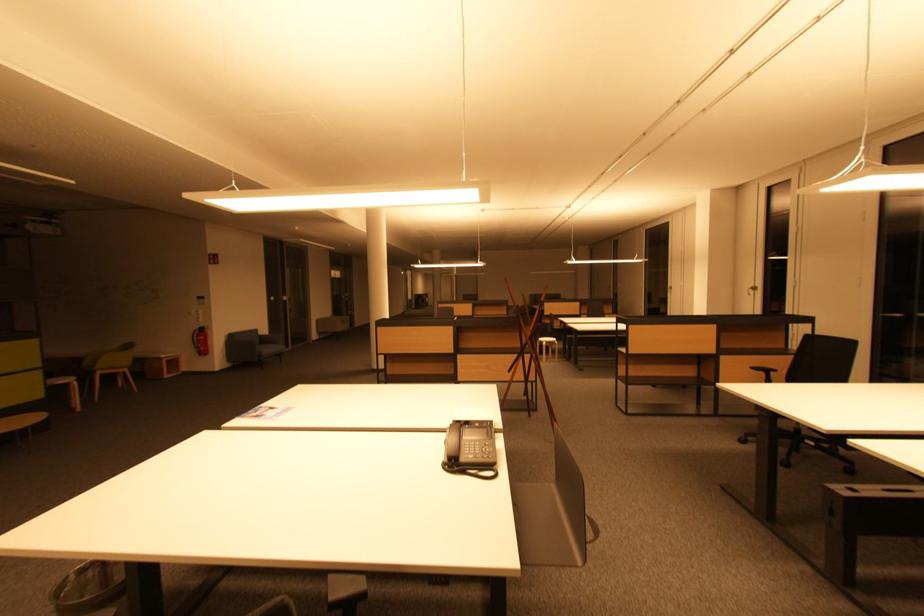
What do you see at coordinates (242, 341) in the screenshot? I see `the sofa armrest` at bounding box center [242, 341].